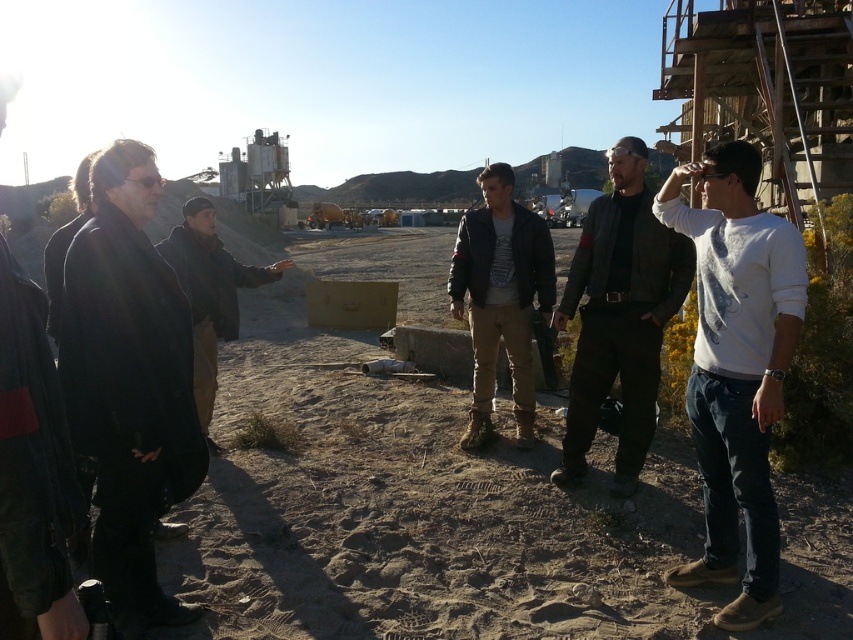
You are standing at the point labeled point (169, 621) in a desert construction site. If you want to move 2 meters forward from your current position, will you be able to walk straight without any obstacles?

Since you are 3.09 meters away from the viewer, moving 2 meters forward would leave you 1.09 meters away from the viewer. There is no mention of obstacles in the scene description, so you can walk straight.

You are a photographer trying to capture a group photo of the black matte jacket at left and the dark gray leather jacket at center. The camera can only focus on one jacket at a time. Which jacket should you focus on to ensure the subject appears larger in the photo?

The dark gray leather jacket at center is larger than the black matte jacket at left, so focusing on the dark gray leather jacket at center will make it appear larger in the photo.

You are a photographer trying to capture a group photo of the black matte jacket at left and the white cotton shirt at right. To ensure both are visible in the frame, where should you position the camera relative to the group?

Position the camera so it faces the group from the front, ensuring the black matte jacket at left is on the left side and the white cotton shirt at right is on the right side of the frame, as the black matte jacket at left is to the left of the white cotton shirt at right.